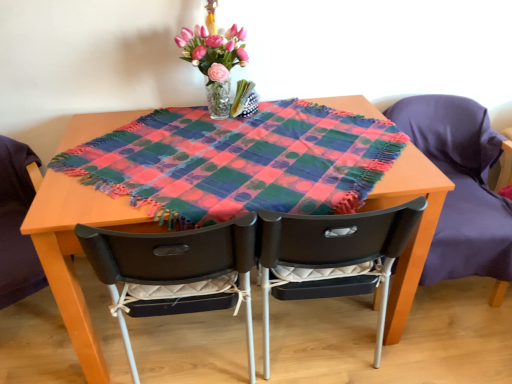
Question: Visually, is matte black chair at right, which is the first chair from right to left, positioned to the left or to the right of black plastic chair at center, the second chair viewed from the left?

Choices:
 (A) right
 (B) left

Answer: (A)

Question: Considering the positions of point (477, 175) and point (403, 208), is point (477, 175) closer or farther from the camera than point (403, 208)?

Choices:
 (A) farther
 (B) closer

Answer: (A)

Question: Estimate the real-world distances between objects in this image. Which object is farther from the matte black chair at right, which is the first chair from right to left?

Choices:
 (A) matte black chair at center, the 1th chair viewed from the left
 (B) translucent glass vase at upper center
 (C) wooden table at center
 (D) black plastic chair at center, the 2th chair positioned from the right

Answer: (C)

Question: Based on their relative distances, which object is nearer to the matte black chair at center, the 1th chair viewed from the left?

Choices:
 (A) wooden table at center
 (B) black plastic chair at center, the second chair viewed from the left
 (C) matte black chair at right, which is the first chair from right to left
 (D) translucent glass vase at upper center

Answer: (A)